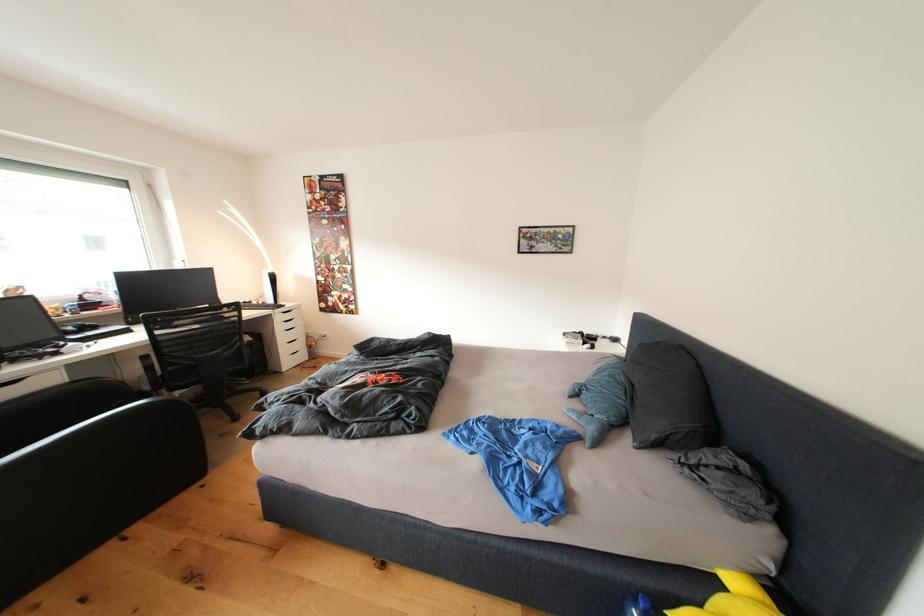
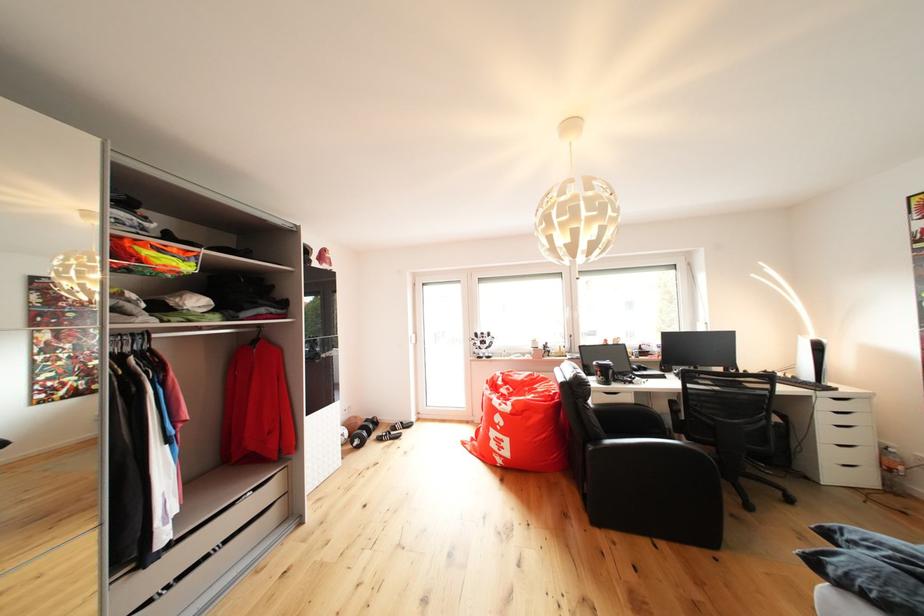
In the second image, find the point that corresponds to [280,276] in the first image.

(822, 342)